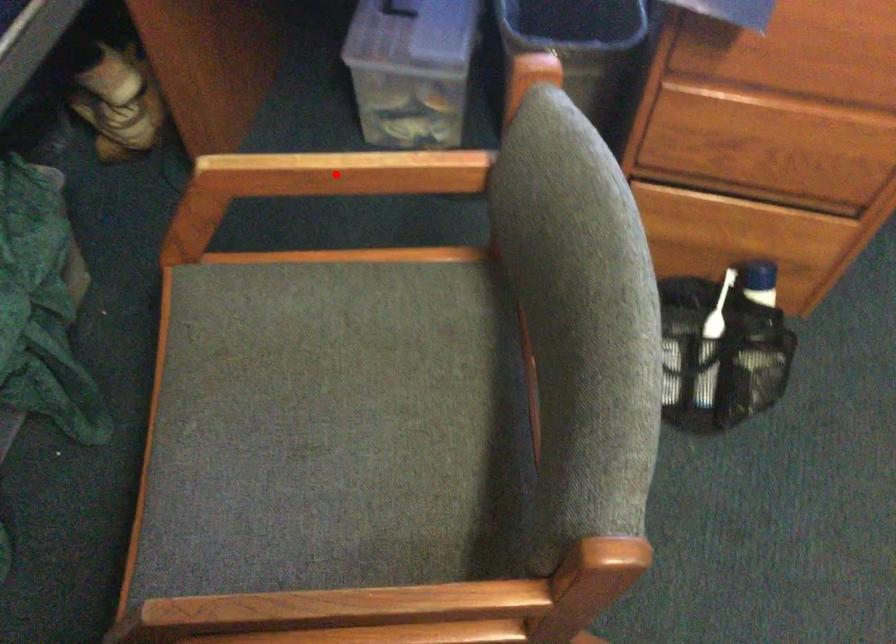
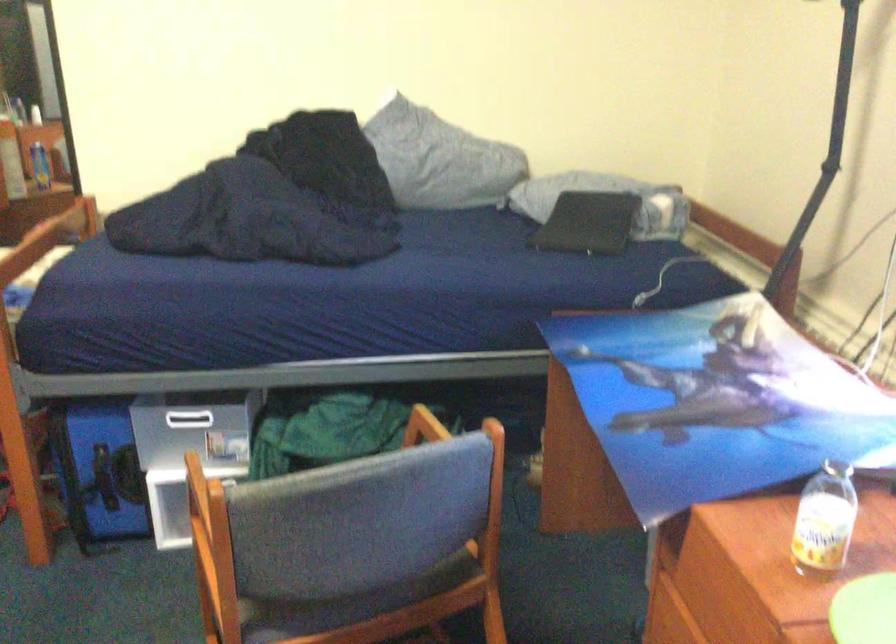
Question: I am providing you with two images of the same scene from different viewpoints. A red point is marked on the first image. At the location where the point appears in image 1, is it still visible in image 2?

Choices:
 (A) Yes
 (B) No

Answer: (B)